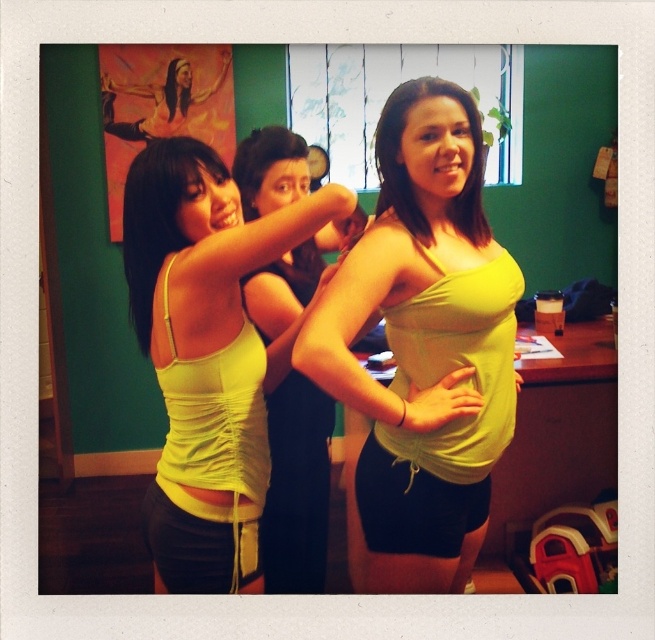
Can you confirm if matte yellow tank top at center is positioned to the right of matte yellow fabric at center?

Incorrect, matte yellow tank top at center is not on the right side of matte yellow fabric at center.

Which is behind, point (259, 467) or point (428, 531)?

Point (428, 531)

Is point (227, 573) behind point (449, 520)?

No, (227, 573) is closer to viewer.

At what (x,y) coordinates should I click in order to perform the action: click on matte yellow tank top at center. Please return your answer as a coordinate pair (x, y). The height and width of the screenshot is (640, 655). Looking at the image, I should click on (208, 355).

Can you confirm if matte yellow tank top at center is shorter than yellow fabric at lower center?

No.

Does matte yellow tank top at center appear on the right side of yellow fabric at lower center?

Correct, you'll find matte yellow tank top at center to the right of yellow fabric at lower center.

Image resolution: width=655 pixels, height=640 pixels. In order to click on matte yellow tank top at center in this screenshot , I will do `click(208, 355)`.

Is point (409, 536) closer to camera compared to point (172, 525)?

No, it is not.

Does matte yellow fabric at center have a greater width compared to yellow fabric at lower center?

Yes.

Does point (483, 509) lie in front of point (147, 506)?

That is False.

Locate an element on the screen. This screenshot has width=655, height=640. matte yellow fabric at center is located at coordinates (415, 506).